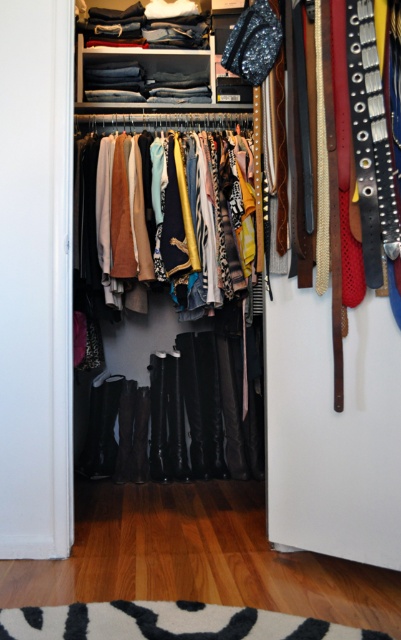
You are trying to reach the point at the back of the closet. Which point, point (x=257, y=611) or point (x=115, y=282), is closer to the back wall?

Point (x=115, y=282) is closer to the back wall because it is behind point (x=257, y=611).

You are standing in the closet and want to place a new pair of shoes on the floor. Where should you place them to ensure they are near the white soft rug at lower center?

Place the shoes near the white soft rug at lower center, which is located at coordinates approximately 0.973 in the x direction and 0.419 in the y direction.